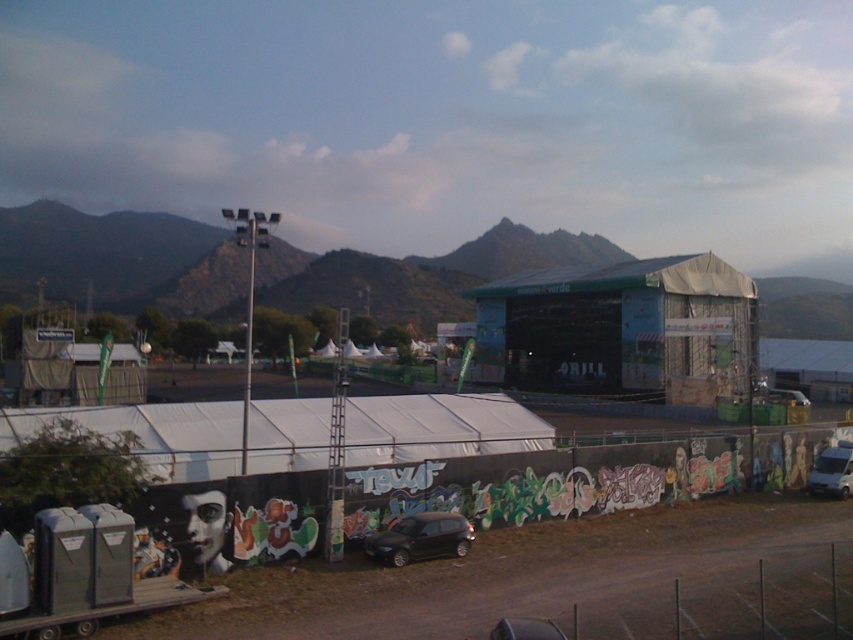
This screenshot has width=853, height=640. What do you see at coordinates (579, 477) in the screenshot?
I see `black graffiti wall at lower center` at bounding box center [579, 477].

Locate an element on the screen. The image size is (853, 640). black graffiti wall at lower center is located at coordinates (579, 477).

Consider the image. Does metallic wire fence at lower right appear under satin black car at lower center?

Yes, metallic wire fence at lower right is below satin black car at lower center.

Is point (549, 636) in front of point (422, 522)?

Yes, point (549, 636) is closer to viewer.

Is point (595, 611) less distant than point (387, 540)?

Yes, it is in front of point (387, 540).

This screenshot has width=853, height=640. I want to click on metallic wire fence at lower right, so click(x=717, y=602).

Who is more distant from viewer, (840, 468) or (776, 392)?

Point (776, 392)

From the picture: Can you confirm if white matte van at lower right is positioned to the right of white matte van at center?

Incorrect, white matte van at lower right is not on the right side of white matte van at center.

Which is behind, point (814, 470) or point (787, 397)?

The point (787, 397) is more distant.

This screenshot has height=640, width=853. Identify the location of white matte van at lower right. (833, 472).